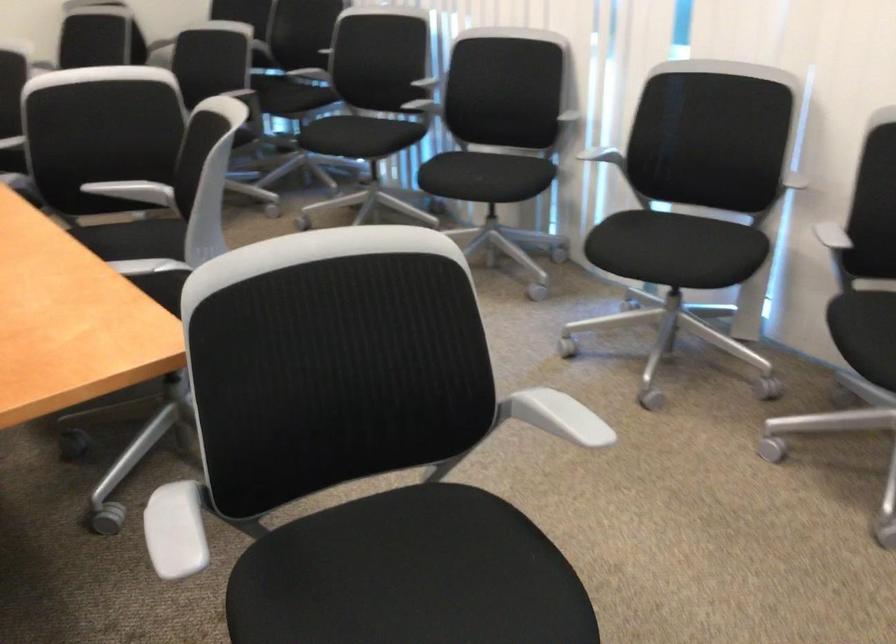
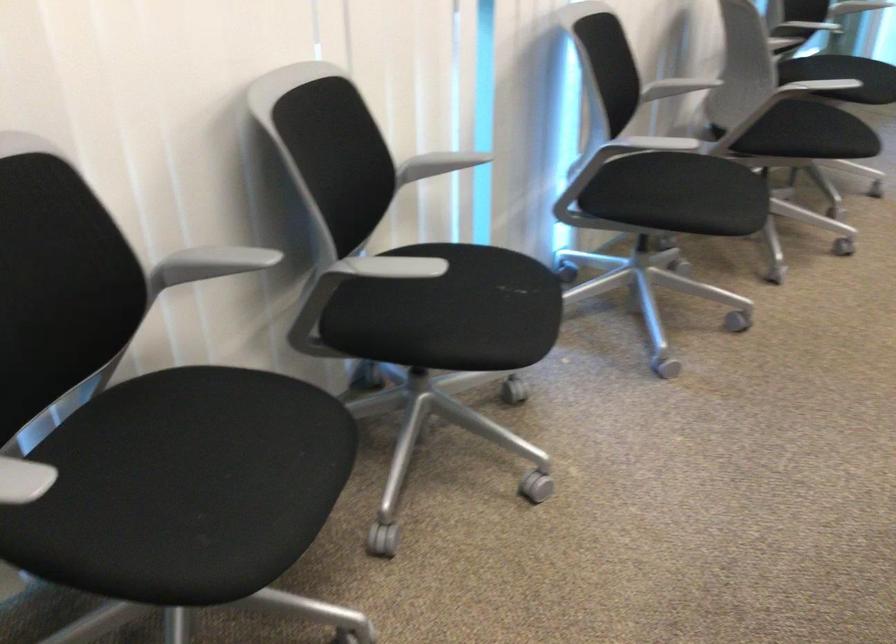
The point at (483, 183) is marked in the first image. Where is the corresponding point in the second image?

(515, 287)